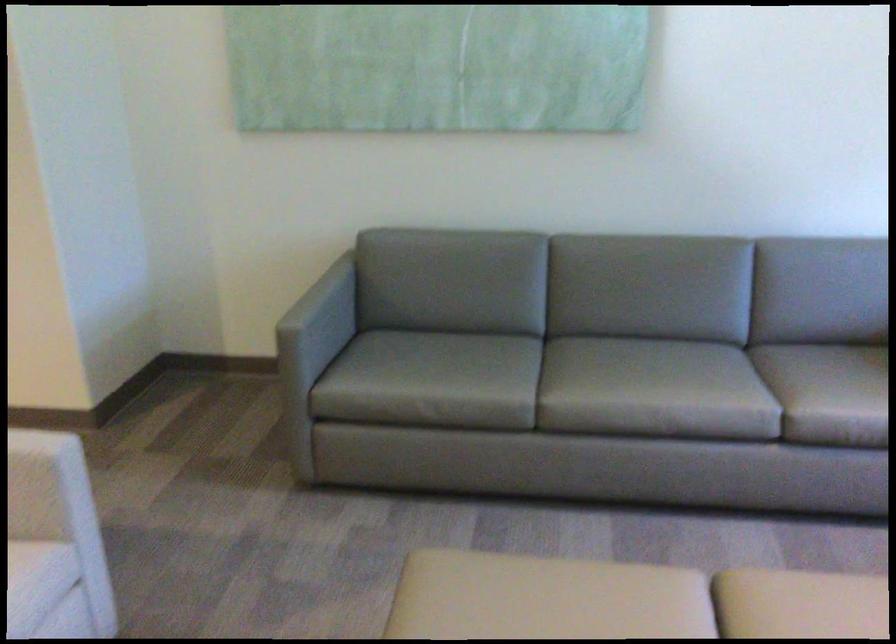
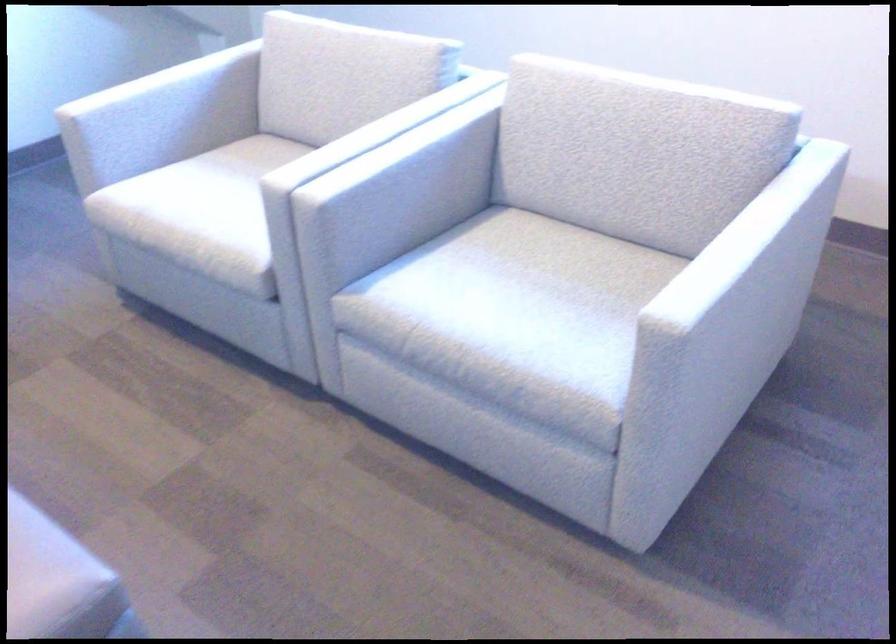
The first image is from the beginning of the video and the second image is from the end. How did the camera likely rotate when shooting the video?

The camera's rotation is toward right-down.